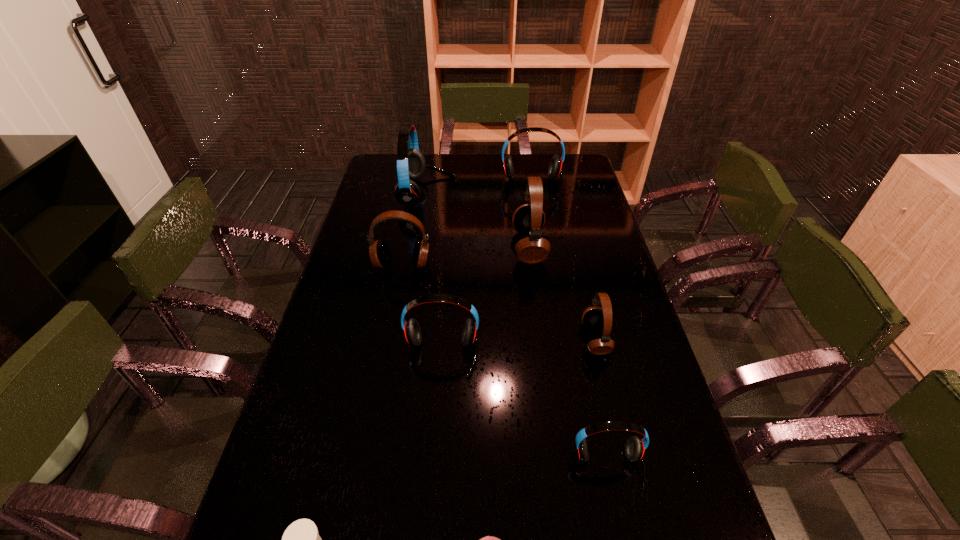
At what (x,y) coordinates should I click in order to perform the action: click on the biggest red headset. Please return your answer as a coordinate pair (x, y). The image size is (960, 540). Looking at the image, I should click on (411, 164).

Locate an element on the screen. the second black headset from left to right is located at coordinates (528, 219).

You are a GUI agent. You are given a task and a screenshot of the screen. Output one action in this format:
    pyautogui.click(x=<x>, y=<y>)
    Task: Click on the third smallest red headset
    This screenshot has height=540, width=960.
    Given the screenshot: What is the action you would take?
    pyautogui.click(x=555, y=169)

The height and width of the screenshot is (540, 960). Identify the location of the second biggest black headset. (380, 255).

You are a GUI agent. You are given a task and a screenshot of the screen. Output one action in this format:
    pyautogui.click(x=<x>, y=<y>)
    Task: Click on the third biggest red headset
    This screenshot has width=960, height=540.
    Given the screenshot: What is the action you would take?
    pyautogui.click(x=411, y=328)

What are the coordinates of `the rightmost black headset` in the screenshot? It's located at (593, 317).

Find the location of a particular element. Image resolution: width=960 pixels, height=540 pixels. the nearest black headset is located at coordinates (593, 317).

Where is `the third nearest object`? Image resolution: width=960 pixels, height=540 pixels. the third nearest object is located at coordinates (635, 447).

Locate an element on the screen. The height and width of the screenshot is (540, 960). the smallest red headset is located at coordinates (635, 447).

Find the location of `free point located 0.050m with the microphone attached to the side of the biggest red headset`. free point located 0.050m with the microphone attached to the side of the biggest red headset is located at coordinates (468, 193).